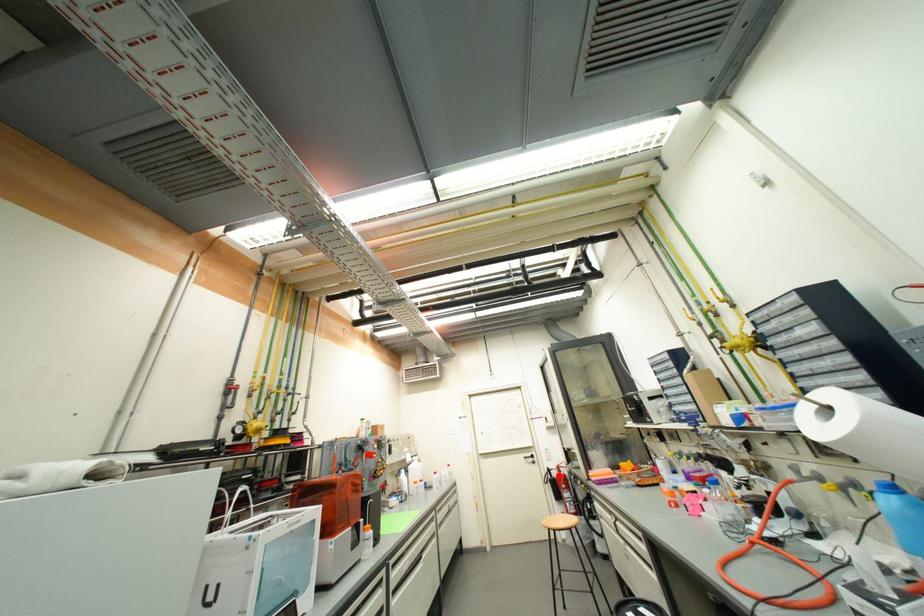
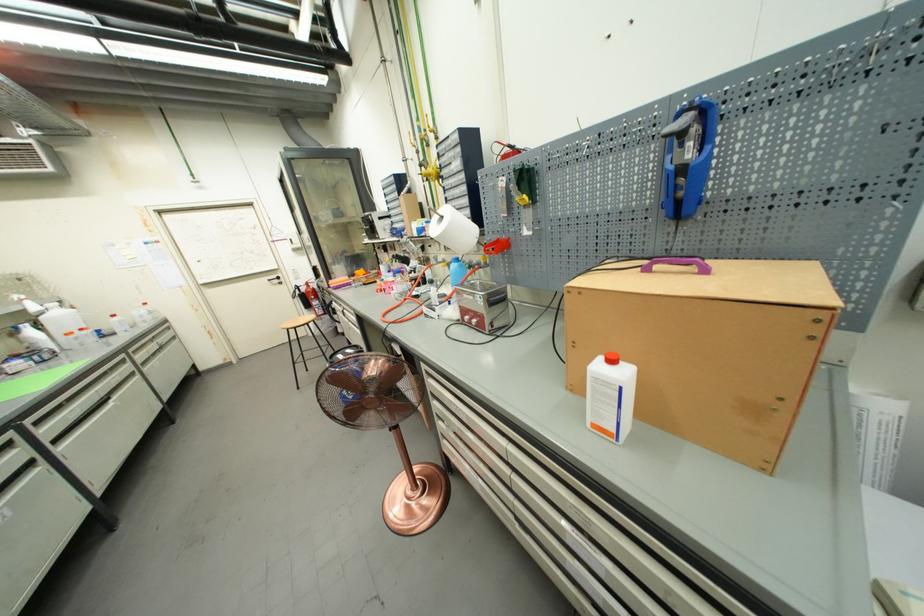
Question: I am providing you with two images of the same scene from different viewpoints. In image1, a red point is highlighted. Considering the same 3D point in image2, which of the following is correct?

Choices:
 (A) It is closer
 (B) It is farther

Answer: (A)